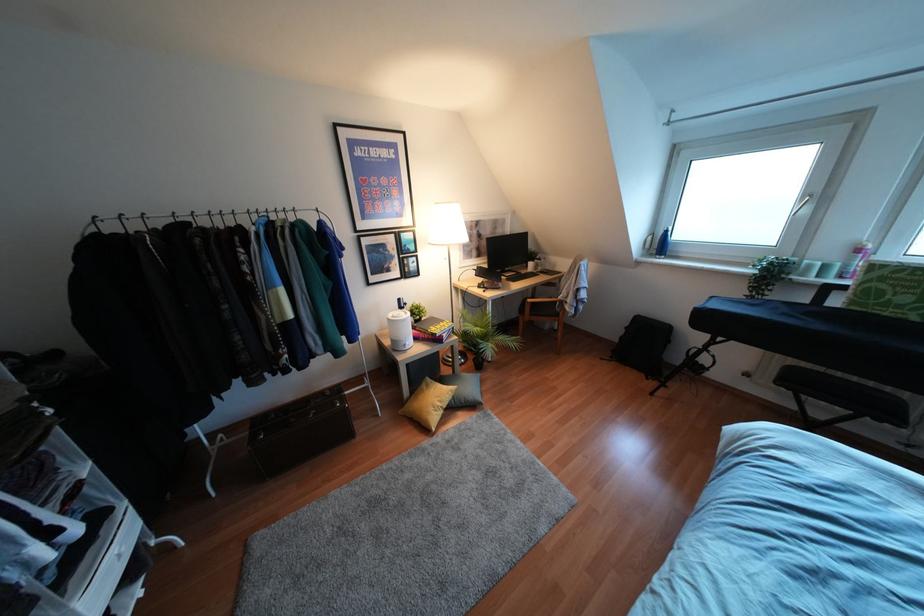
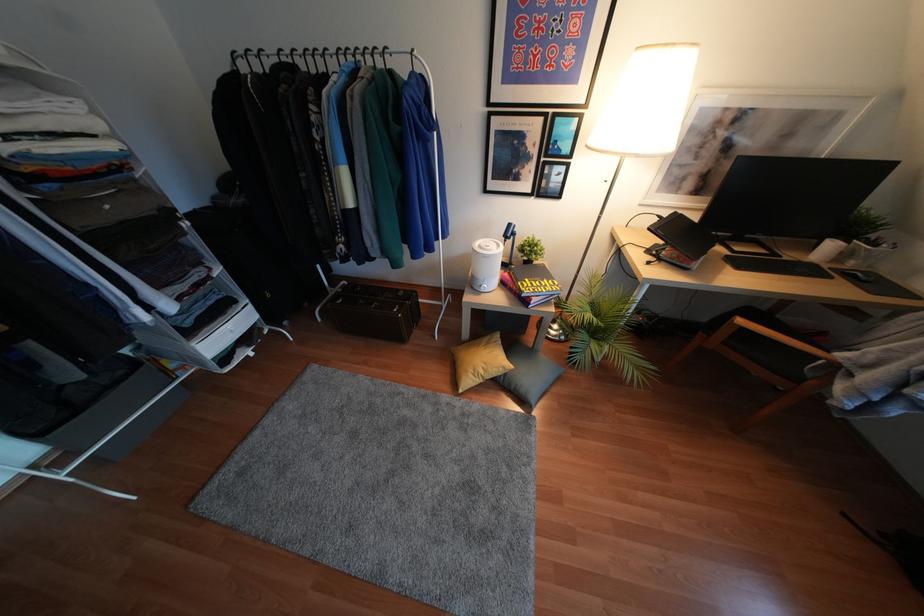
In the second image, find the point that corresponds to point 426,442 in the first image.

(445, 397)